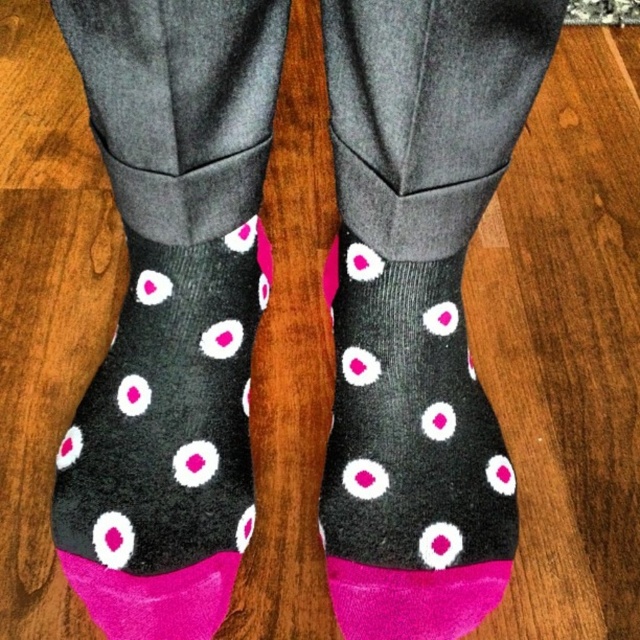
Between black fuzzy socks at center and matte black socks with pink dots at center, which one appears on the left side from the viewer's perspective?

Positioned to the left is black fuzzy socks at center.

Between black fuzzy socks at center and matte black socks with pink dots at center, which one appears on the right side from the viewer's perspective?

Positioned to the right is matte black socks with pink dots at center.

This screenshot has width=640, height=640. Identify the location of black fuzzy socks at center. (428, 109).

The image size is (640, 640). Find the location of `black fuzzy socks at center`. black fuzzy socks at center is located at coordinates (428, 109).

Does black fuzzy socks at center have a larger size compared to pink dotted socks at center?

Yes.

Is point (150, 1) in front of point (129, 518)?

Yes, point (150, 1) is closer to viewer.

This screenshot has width=640, height=640. Find the location of `black fuzzy socks at center`. black fuzzy socks at center is located at coordinates (428, 109).

Does pink dotted socks at center appear on the right side of matte black socks with pink dots at center?

In fact, pink dotted socks at center is to the left of matte black socks with pink dots at center.

Between point (170, 262) and point (412, 392), which one is positioned behind?

The point (412, 392) is behind.

This screenshot has width=640, height=640. In order to click on pink dotted socks at center in this screenshot , I will do `click(164, 444)`.